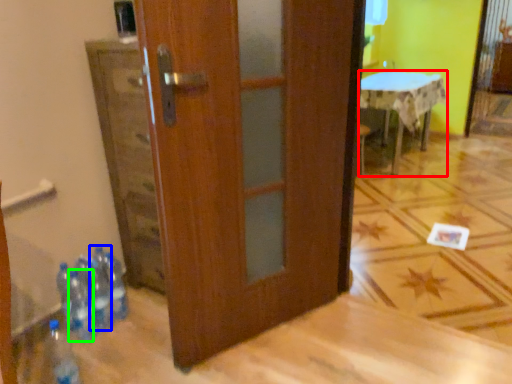
Question: Which is nearer to the table (highlighted by a red box)? bottle (highlighted by a blue box) or bottle (highlighted by a green box).

Choices:
 (A) bottle
 (B) bottle

Answer: (A)